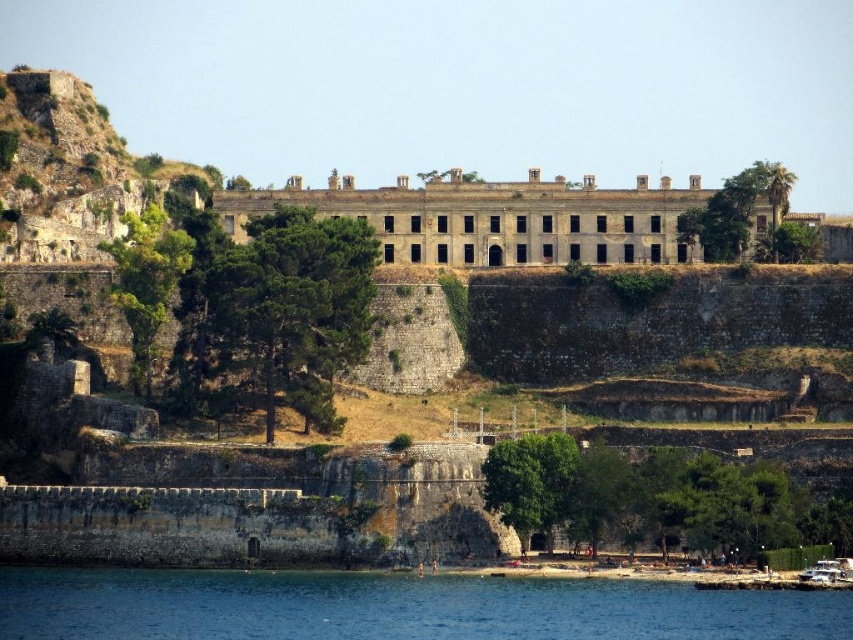
Question: Can you confirm if clear blue water at lower left is positioned to the left of gray stone building at center?

Choices:
 (A) yes
 (B) no

Answer: (A)

Question: Can you confirm if clear blue water at lower left is smaller than gray stone building at center?

Choices:
 (A) yes
 (B) no

Answer: (A)

Question: Is clear blue water at lower left positioned in front of gray stone building at center?

Choices:
 (A) yes
 (B) no

Answer: (A)